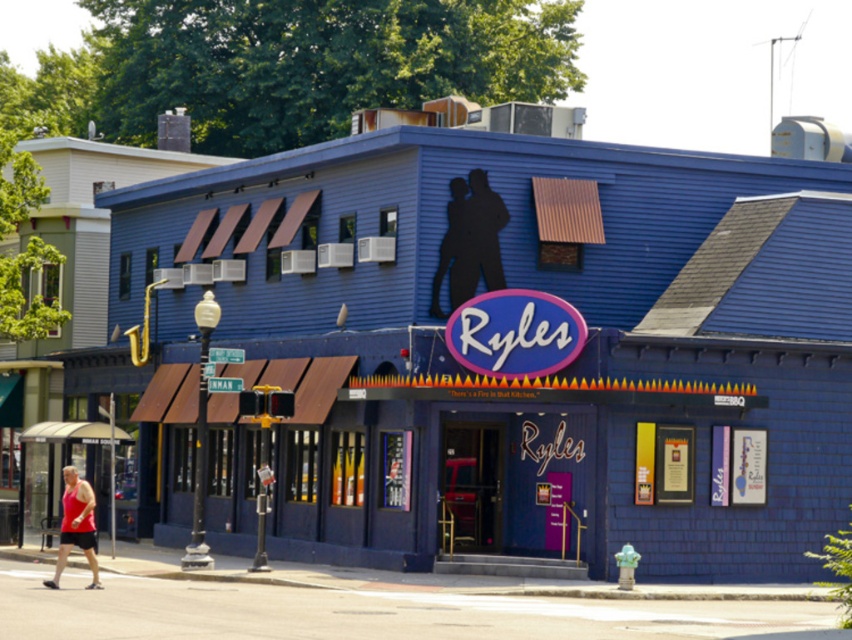
Question: Can you confirm if blue wooden shed at lower left is positioned to the right of red tank top at lower left?

Choices:
 (A) yes
 (B) no

Answer: (A)

Question: Which point is farther from the camera taking this photo?

Choices:
 (A) (435, 476)
 (B) (88, 509)

Answer: (A)

Question: Is blue wooden shed at lower left smaller than red tank top at lower left?

Choices:
 (A) no
 (B) yes

Answer: (A)

Question: Can you confirm if blue wooden shed at lower left is positioned to the right of red tank top at lower left?

Choices:
 (A) yes
 (B) no

Answer: (A)